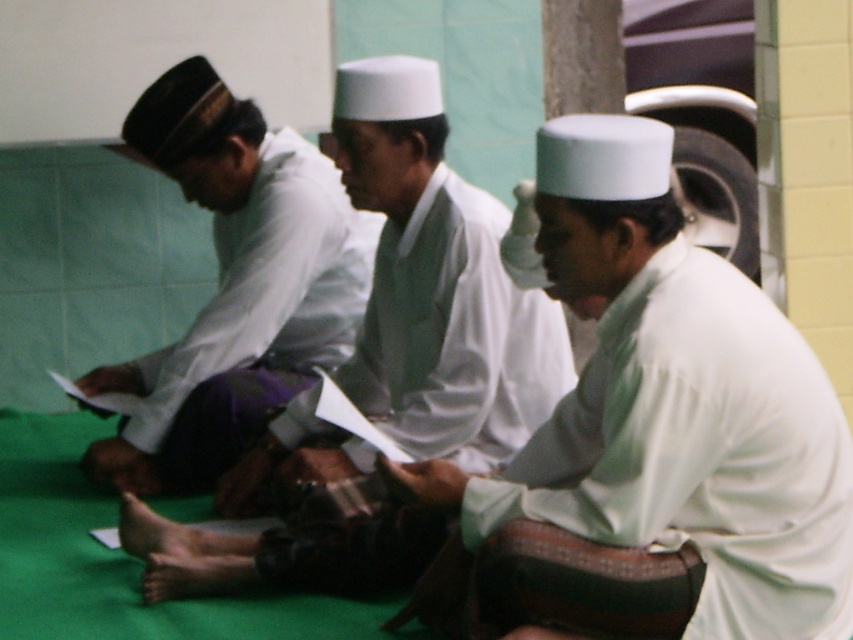
You are standing in front of the three individuals and want to place a small offering between the two points marked as point (x=637, y=508) and point (x=468, y=408). Which point is closer to you where you should place the offering first?

Point (x=637, y=508) is closer to the viewer than point (x=468, y=408), so you should place the offering first at point (x=637, y=508).

You are standing in front of the three individuals. Which of the two points, point (x=526, y=330) or point (x=370, y=253), is closer to you?

Point (x=526, y=330) is in front of point (x=370, y=253), so it is closer to you.

You are a photographer trying to capture a candid shot of the light green fabric at center and the matte white shirt at center. Since you want to focus on both objects equally, which one should you adjust your camera angle to prioritize in terms of size in the frame?

The light green fabric at center is larger in width than the matte white shirt at center, so to focus on both equally, you should adjust your camera angle to make the light green fabric at center appear smaller or move closer to the matte white shirt at center to balance their sizes in the frame.